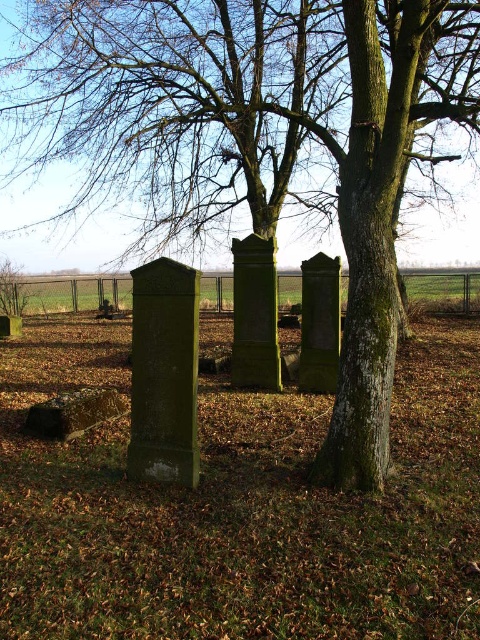
Does green grass at center have a greater height compared to smooth stone gravestone at lower left?

Yes, green grass at center is taller than smooth stone gravestone at lower left.

Does green grass at center appear on the right side of smooth stone gravestone at lower left?

Correct, you'll find green grass at center to the right of smooth stone gravestone at lower left.

Which is in front, point (456, 296) or point (61, 416)?

Point (61, 416) is in front.

You are a GUI agent. You are given a task and a screenshot of the screen. Output one action in this format:
    pyautogui.click(x=<x>, y=<y>)
    Task: Click on the green grass at center
    
    Given the screenshot: What is the action you would take?
    pyautogui.click(x=64, y=296)